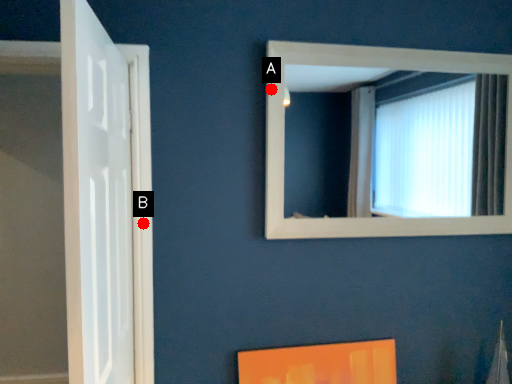
Question: Two points are circled on the image, labeled by A and B beside each circle. Which point appears farthest from the camera in this image?

Choices:
 (A) A is further
 (B) B is further

Answer: (A)